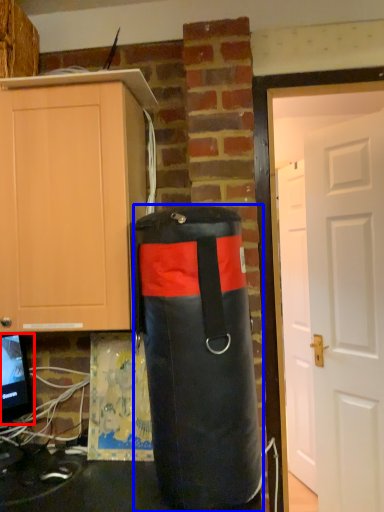
Question: Which object appears closest to the camera in this image, computer monitor (highlighted by a red box) or punching bag (highlighted by a blue box)?

Choices:
 (A) computer monitor
 (B) punching bag

Answer: (B)